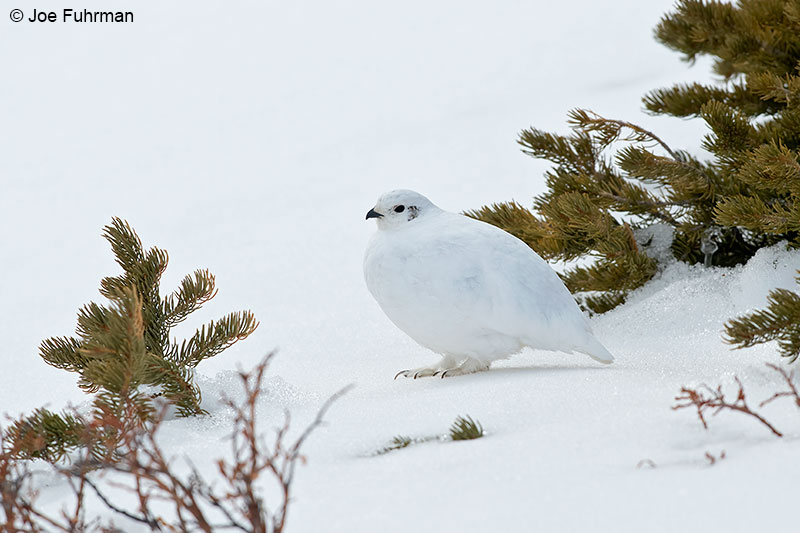
In order to click on chest in this screenshot , I will do `click(392, 298)`.